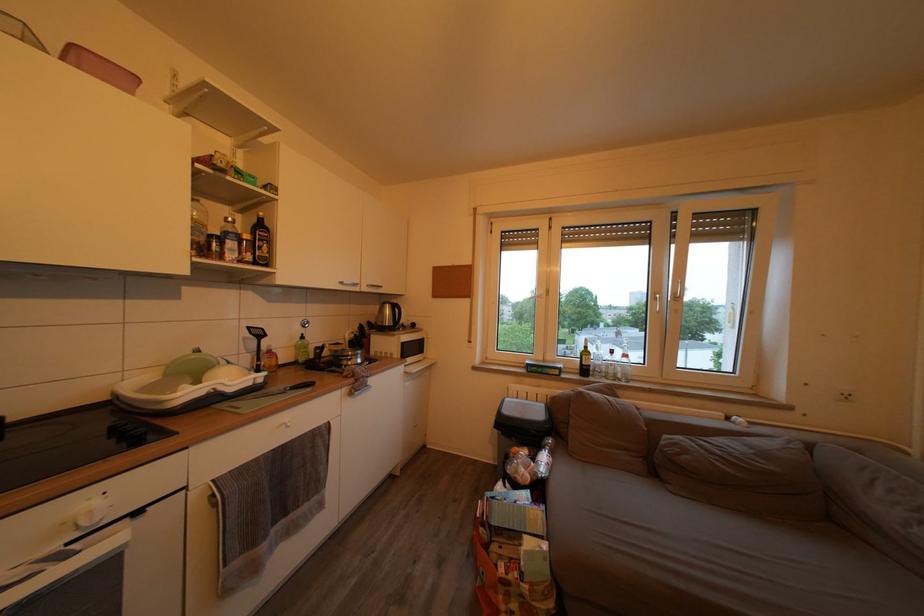
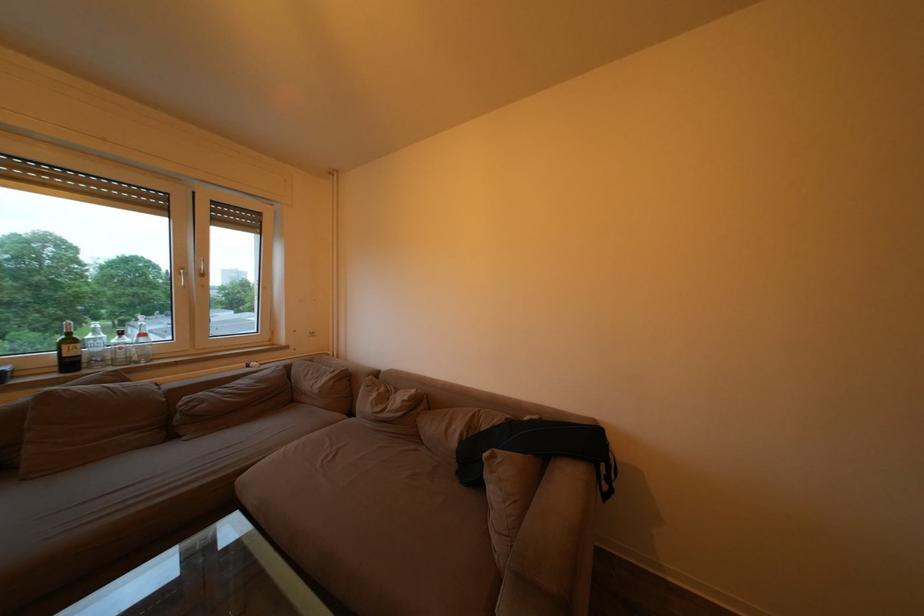
Find the pixel in the second image that matches point 608,369 in the first image.

(107, 355)